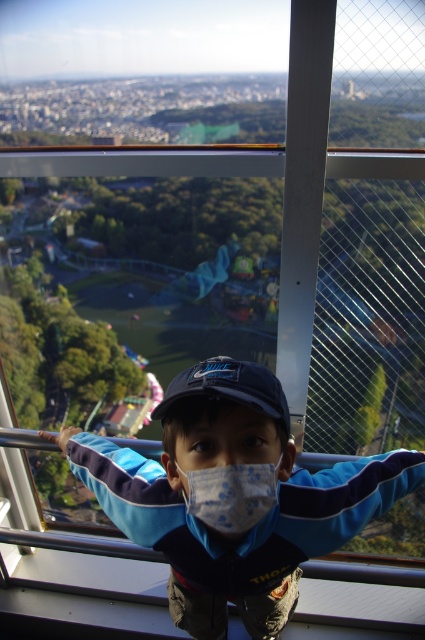
Question: Which object is closer to the camera taking this photo?

Choices:
 (A) blue fabric jacket at center
 (B) navy blue fabric baseball cap at center

Answer: (A)

Question: Which point is closer to the camera?

Choices:
 (A) blue fabric jacket at center
 (B) navy blue fabric baseball cap at center
 (C) blue fabric mask at center

Answer: (C)

Question: In this image, where is blue fabric jacket at center located relative to navy blue fabric baseball cap at center?

Choices:
 (A) above
 (B) below

Answer: (B)

Question: Can you confirm if blue fabric mask at center is positioned to the right of navy blue fabric baseball cap at center?

Choices:
 (A) yes
 (B) no

Answer: (A)

Question: Is blue fabric mask at center below navy blue fabric baseball cap at center?

Choices:
 (A) no
 (B) yes

Answer: (A)

Question: Which point is farther to the camera?

Choices:
 (A) (277, 468)
 (B) (178, 424)
 (C) (240, 376)

Answer: (A)